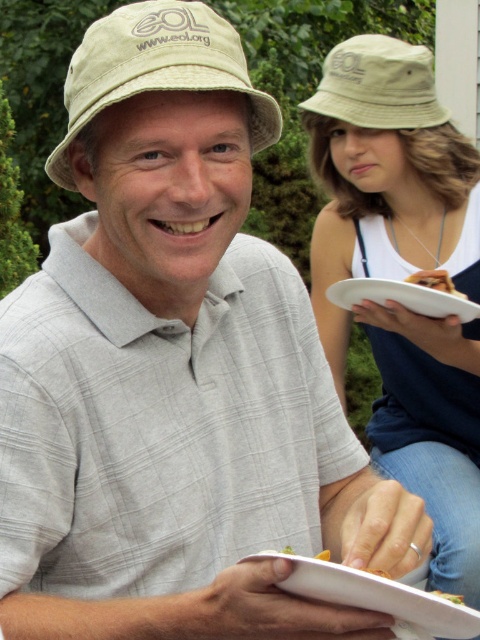
Question: Which is nearer to the matte beige bucket hat at upper center?

Choices:
 (A) white paper plate at center
 (B) yellow matte plate at lower center

Answer: (A)

Question: Which point appears farthest from the camera in this image?

Choices:
 (A) (463, 602)
 (B) (439, 282)
 (C) (447, 312)

Answer: (B)

Question: Which point is farther from the camera taking this photo?

Choices:
 (A) (444, 595)
 (B) (432, 298)
 (C) (430, 369)

Answer: (C)

Question: Can you confirm if white paper plate at center is positioned to the right of yellow matte plate at lower center?

Choices:
 (A) no
 (B) yes

Answer: (A)

Question: Does white paper plate at center have a larger size compared to brown crumbly bread at upper right?

Choices:
 (A) yes
 (B) no

Answer: (A)

Question: Is matte beige bucket hat at upper center further to camera compared to yellow matte plate at lower center?

Choices:
 (A) yes
 (B) no

Answer: (A)